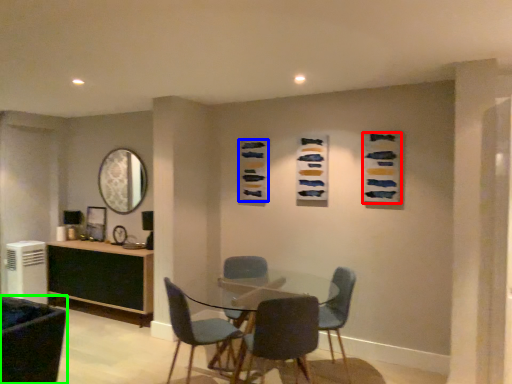
Question: Considering the real-world distances, which object is closest to art (highlighted by a red box)? art (highlighted by a blue box) or chair (highlighted by a green box).

Choices:
 (A) art
 (B) chair

Answer: (A)